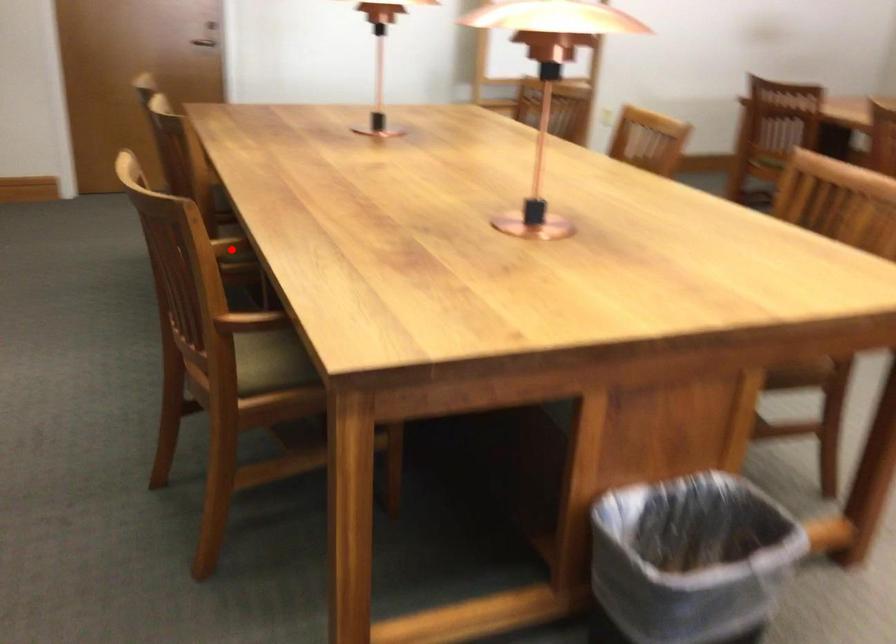
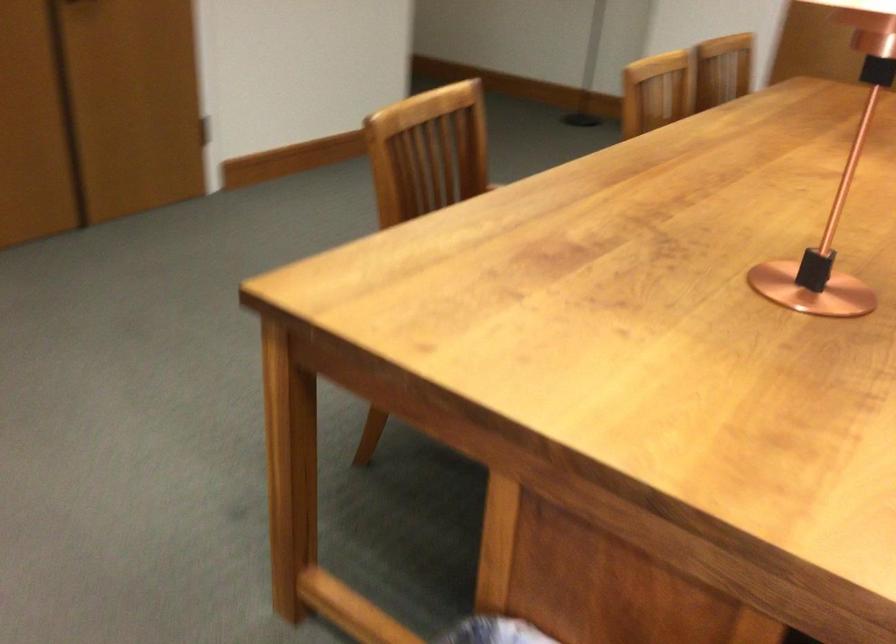
Question: I am providing you with two images of the same scene from different viewpoints. A red point is marked on the first image. Can you still see the location of the red point in image 2?

Choices:
 (A) Yes
 (B) No

Answer: (B)